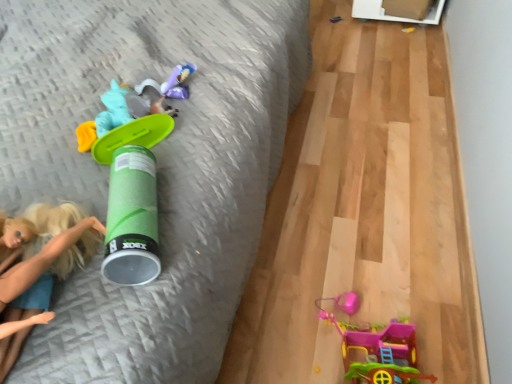
This screenshot has width=512, height=384. What are the coordinates of `free space between metallic silver toy at upper right, marked as the fifth toy in a front-to-back arrangement, and plastic pink toy house at lower right, which ranks as the first toy in bottom-to-top order` in the screenshot? It's located at (355, 155).